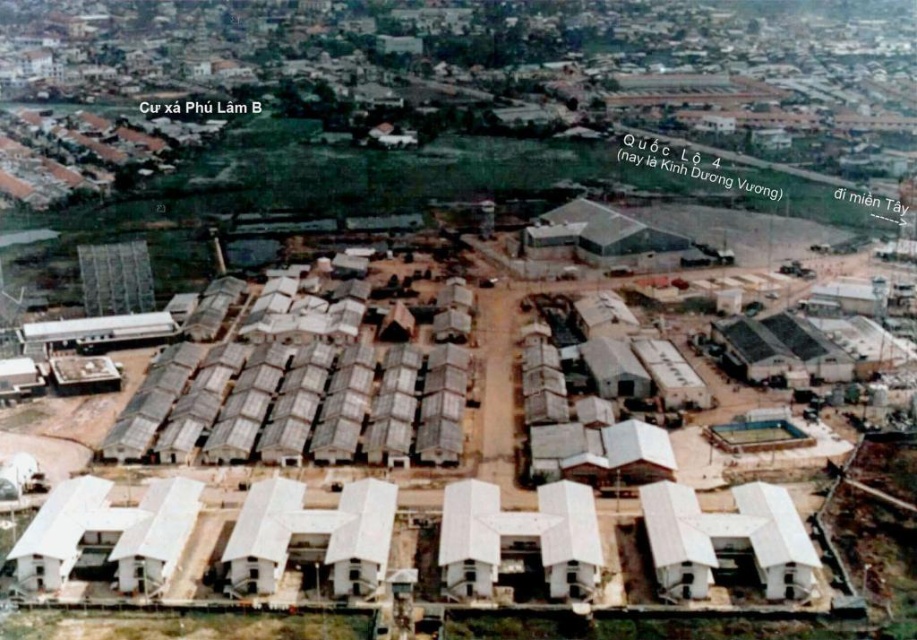
You are a delivery drone flying over the residential area and need to land near the white corrugated metal hut at lower right and the gray corrugated metal hut at center. Based on their positions, which hut is closer to the industrial buildings?

The white corrugated metal hut at lower right is located below the gray corrugated metal hut at center, so the white corrugated metal hut at lower right is closer to the industrial buildings since it is positioned lower in the image, which is typically the direction towards the ground or closer proximity in aerial views.

You are a delivery drone that needs to deliver a package to the white corrugated metal hut at lower right. The maximum distance you can travel is 200 feet. Can you reach it?

The distance between them is 229.99 feet, which exceeds the drone maximum travel distance of 200 feet. The drone cannot reach the white corrugated metal hut at lower right.